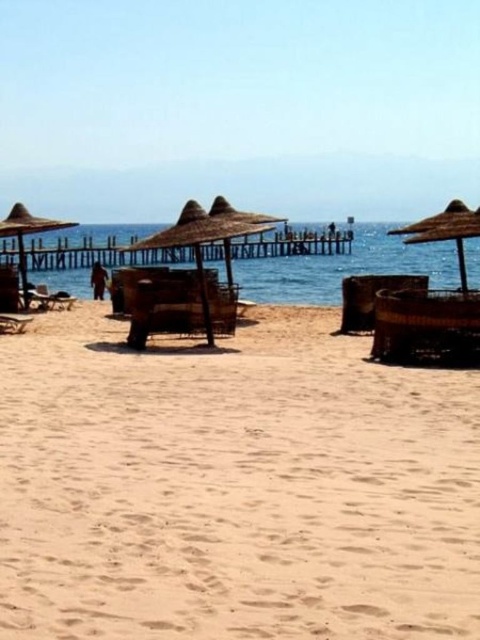
Question: Which point is farther from the camera taking this photo?

Choices:
 (A) (464, 289)
 (B) (208, 496)
 (C) (7, 224)
 (D) (192, 273)

Answer: (C)

Question: In this image, where is sandy beige at center located relative to blue water at center?

Choices:
 (A) right
 (B) left

Answer: (B)

Question: Estimate the real-world distances between objects in this image. Which object is farther from the blue water at center?

Choices:
 (A) brown woven umbrella at center
 (B) sandy beige at center
 (C) straw umbrella at right

Answer: (B)

Question: Considering the relative positions of straw umbrella at right and straw umbrella at left in the image provided, where is straw umbrella at right located with respect to straw umbrella at left?

Choices:
 (A) right
 (B) left

Answer: (A)

Question: Which point is farther to the camera?

Choices:
 (A) (332, 532)
 (B) (396, 257)

Answer: (B)

Question: Is the position of blue water at center more distant than that of straw umbrella at right?

Choices:
 (A) no
 (B) yes

Answer: (B)